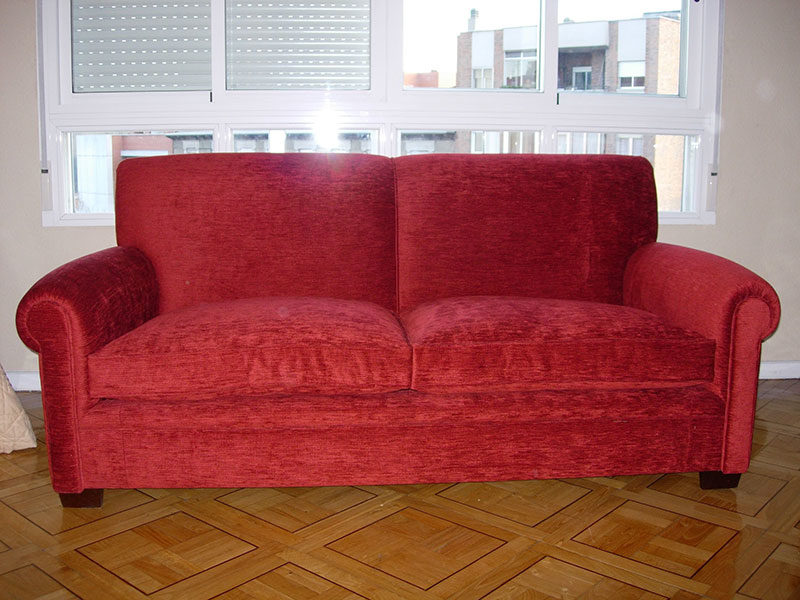
Image resolution: width=800 pixels, height=600 pixels. Find the location of `fabric`. fabric is located at coordinates (109, 307), (246, 347), (482, 340), (680, 307), (542, 264), (369, 277), (397, 449).